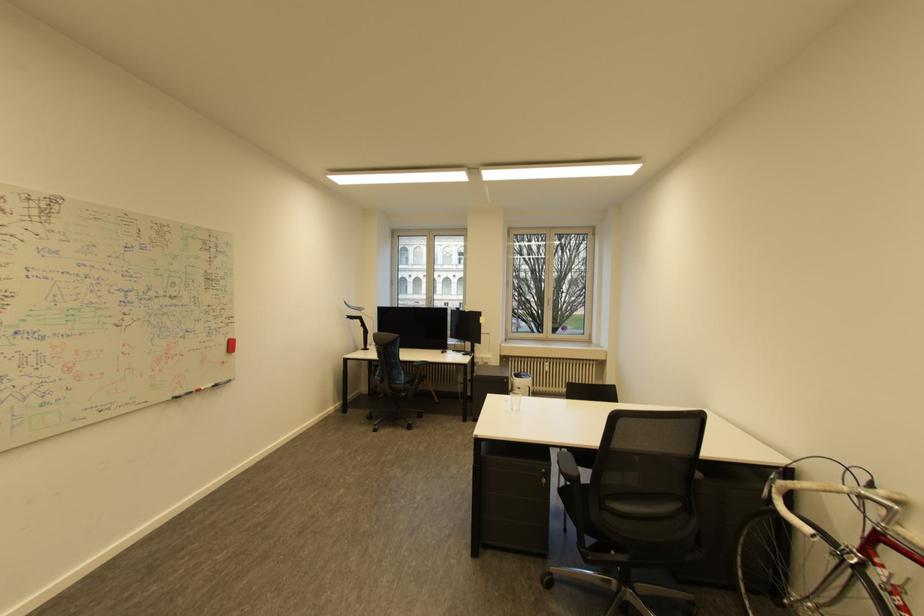
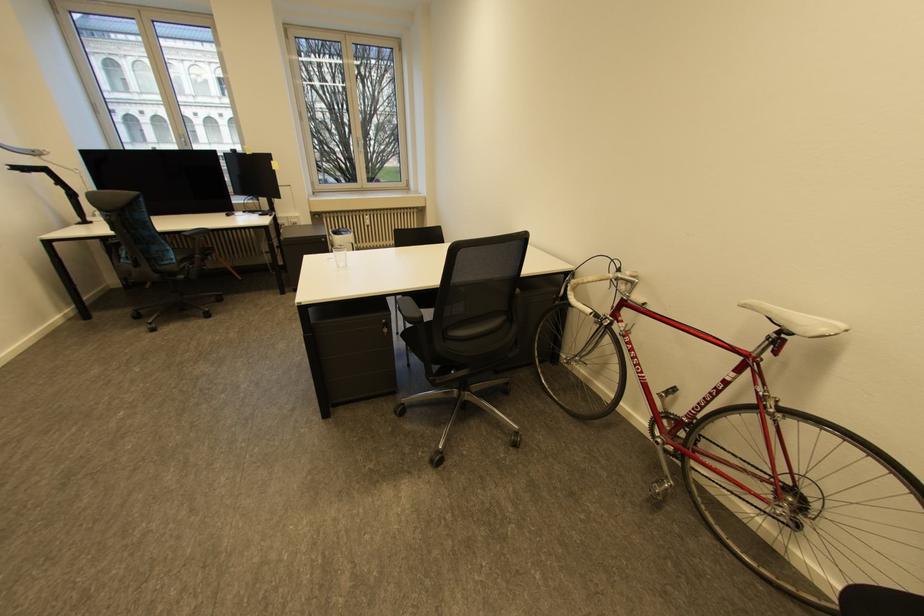
Where in the second image is the point corresponding to (x=776, y=501) from the first image?

(572, 299)